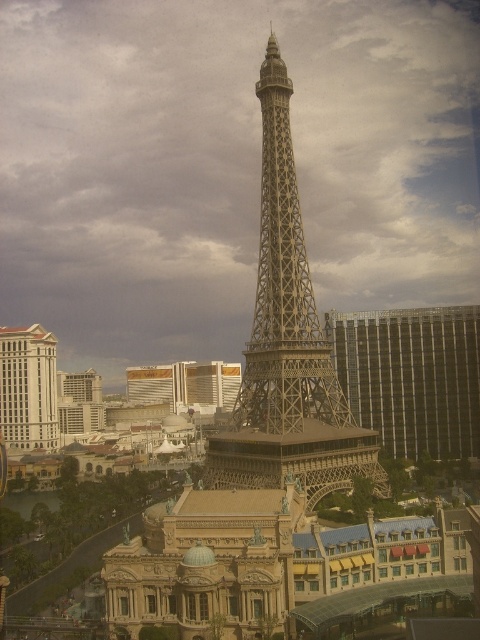
You are a tourist standing in front of the Paris Las Vegas hotel, which has two metallic silver buildings. Looking at the metallic silver building at right and the metallic silver building at lower left, which one appears wider from your perspective?

The metallic silver building at right appears wider than the metallic silver building at lower left because its width surpasses the other.

You are standing in front of the Paris Las Vegas hotel and see the metallic silver building at right and the metallic silver building at lower left. Which one is located to the right side?

The metallic silver building at right is positioned on the right side of the metallic silver building at lower left.